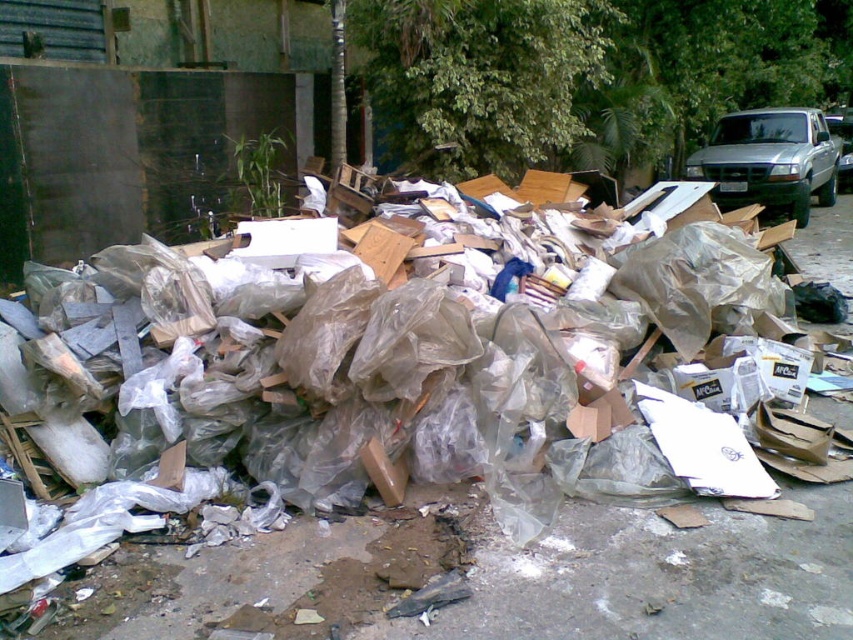
Which of these two, translucent plastic debris at center or silver metallic truck at upper right, stands taller?

translucent plastic debris at center is taller.

Is translucent plastic debris at center above silver metallic truck at upper right?

No, translucent plastic debris at center is not above silver metallic truck at upper right.

Is point (606, 609) more distant than point (793, 212)?

No, it is in front of (793, 212).

Image resolution: width=853 pixels, height=640 pixels. What are the coordinates of `translucent plastic debris at center` in the screenshot? It's located at (236, 582).